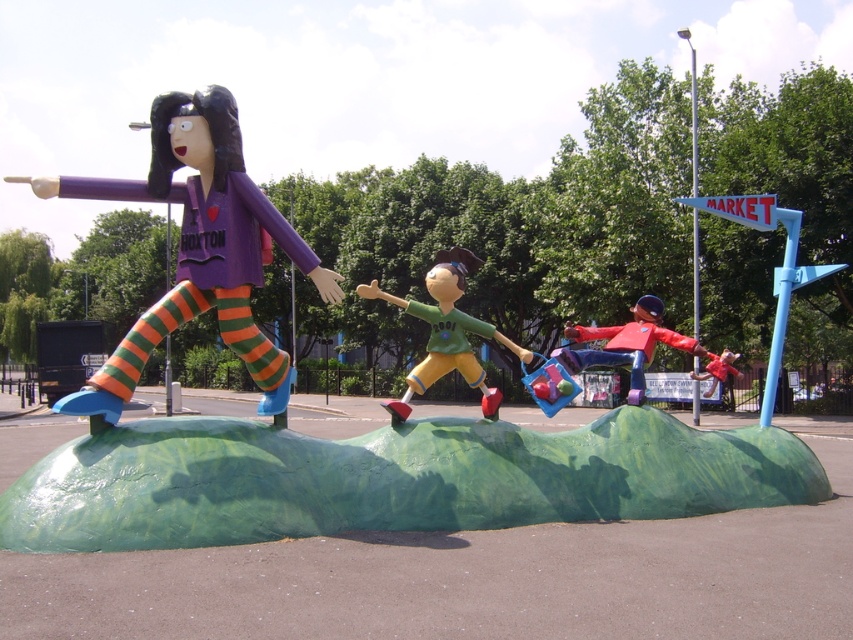
Which is below, matte purple figure at left or red fabric scarecrow at lower right?

red fabric scarecrow at lower right

Which of these two, matte purple figure at left or red fabric scarecrow at lower right, stands shorter?

Standing shorter between the two is matte purple figure at left.

Where is `matte purple figure at left`? Image resolution: width=853 pixels, height=640 pixels. matte purple figure at left is located at coordinates (212, 248).

Consider the image. Does matte purple figure at left have a larger size compared to matte green plastic toy at center?

No, matte purple figure at left is not bigger than matte green plastic toy at center.

Consider the image. Is matte purple figure at left taller than matte green plastic toy at center?

In fact, matte purple figure at left may be shorter than matte green plastic toy at center.

Is point (265, 252) positioned in front of point (361, 285)?

Yes, point (265, 252) is closer to viewer.

Where is `matte purple figure at left`? This screenshot has width=853, height=640. matte purple figure at left is located at coordinates (212, 248).

Is matte green plastic toy at center below red fabric scarecrow at lower right?

Actually, matte green plastic toy at center is above red fabric scarecrow at lower right.

Is point (360, 296) positioned in front of point (659, 323)?

Yes, it is in front of point (659, 323).

This screenshot has height=640, width=853. Find the location of `matte green plastic toy at center`. matte green plastic toy at center is located at coordinates (445, 332).